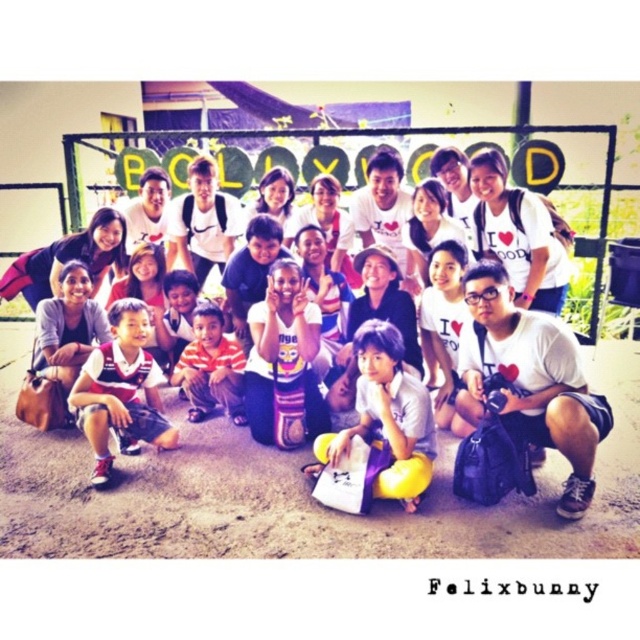
In the photo, there is a striped jersey at lower left and a white matte plush toy at center. Which object is positioned more to the left?

The striped jersey at lower left is positioned more to the left than the white matte plush toy at center.

You are a photographer trying to capture a clear shot of the white matte plush toy at center and the striped fabric pants at center. Which object will appear larger in the photo?

The white matte plush toy at center will appear larger in the photo because it is much taller than the striped fabric pants at center.